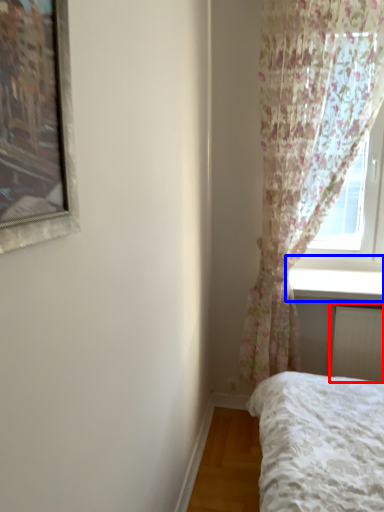
Question: Which of the following is the closest to the observer, radiator (highlighted by a red box) or window sill (highlighted by a blue box)?

Choices:
 (A) radiator
 (B) window sill

Answer: (B)